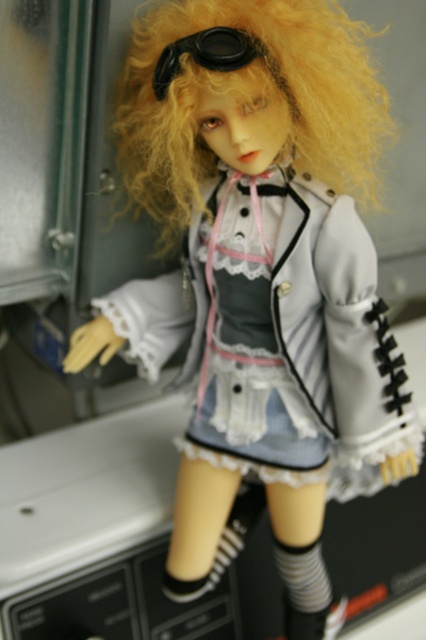
Question: Which of the following is the closest to the observer?

Choices:
 (A) curly blonde hair at upper center
 (B) black matte goggles at upper center

Answer: (A)

Question: Which object appears closest to the camera in this image?

Choices:
 (A) curly blonde hair at upper center
 (B) black matte goggles at upper center

Answer: (A)

Question: Where is curly blonde hair at upper center located in relation to black matte goggles at upper center in the image?

Choices:
 (A) right
 (B) left

Answer: (A)

Question: Which of the following is the closest to the observer?

Choices:
 (A) 313,22
 (B) 238,48

Answer: (B)

Question: Does curly blonde hair at upper center have a larger size compared to black matte goggles at upper center?

Choices:
 (A) yes
 (B) no

Answer: (A)

Question: Is curly blonde hair at upper center positioned in front of black matte goggles at upper center?

Choices:
 (A) no
 (B) yes

Answer: (B)